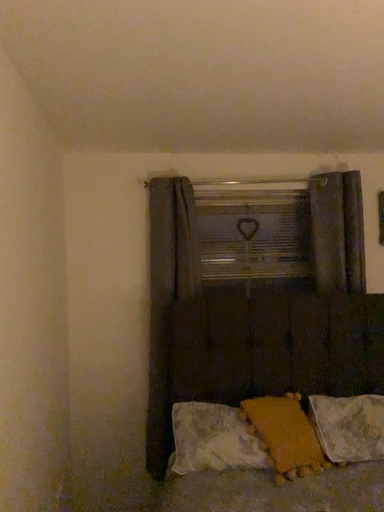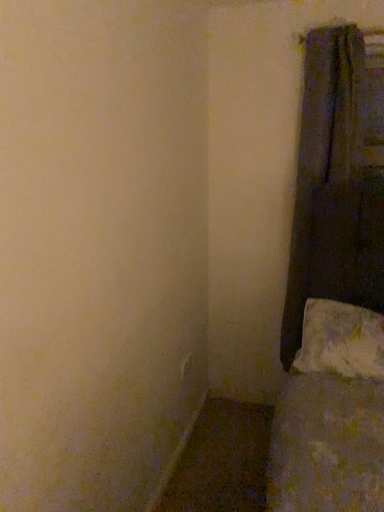
Question: Which way did the camera rotate in the video?

Choices:
 (A) rotated downward
 (B) rotated upward

Answer: (A)